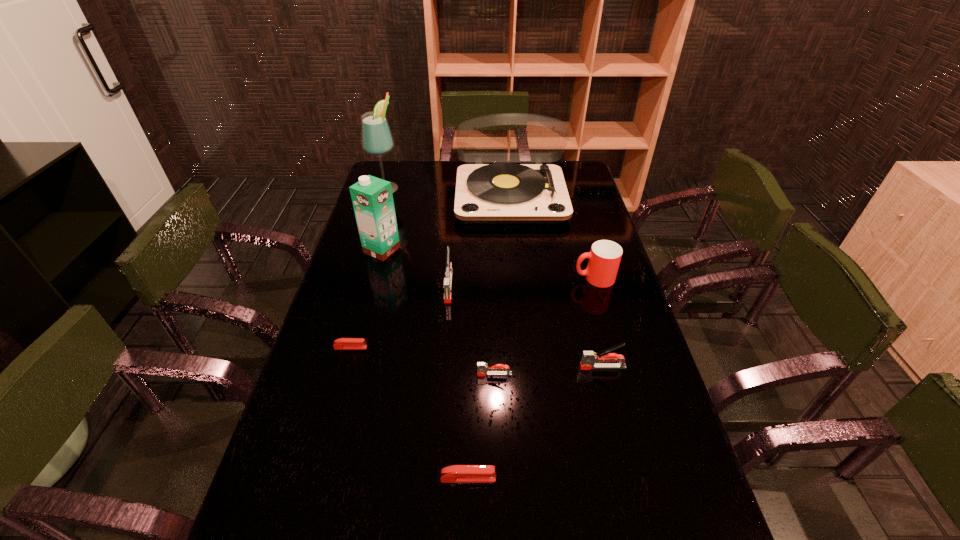
Identify the location of vacant space that satisfies the following two spatial constraints: 1. with the tonearm facing the front of the record player; 2. on the side of the cup with the handle. The image size is (960, 540). (518, 278).